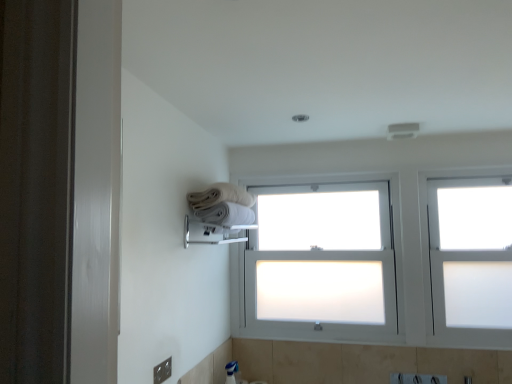
At what (x,y) coordinates should I click in order to perform the action: click on white cotton towels at upper center, which is counted as the 1th towel, starting from the top. Please return your answer as a coordinate pair (x, y). This screenshot has height=384, width=512. Looking at the image, I should click on coord(220,196).

I want to click on white soft towel at upper center, which is counted as the 2th towel, starting from the top, so click(226, 214).

This screenshot has height=384, width=512. What are the coordinates of `white frosted glass bay window at center` in the screenshot? It's located at tap(321, 256).

Does white frosted glass bay window at center come in front of white cotton towels at upper center, which is counted as the 1th towel, starting from the top?

No.

From a real-world perspective, is white frosted glass bay window at center physically located above or below white cotton towels at upper center, the 2th towel positioned from the bottom?

Clearly, from a real-world perspective, white frosted glass bay window at center is below white cotton towels at upper center, the 2th towel positioned from the bottom.

Is white frosted glass bay window at center positioned far away from white cotton towels at upper center, the 2th towel positioned from the bottom?

No.

Measure the distance between white frosted glass bay window at center and white cotton towels at upper center, which is counted as the 1th towel, starting from the top.

white frosted glass bay window at center is 25.94 inches away from white cotton towels at upper center, which is counted as the 1th towel, starting from the top.

What's the angular difference between polished chrome towel bar at upper center and metallic silver outlet at lower left's facing directions?

There is a 0.217-degree angle between the facing directions of polished chrome towel bar at upper center and metallic silver outlet at lower left.

From the image's perspective, is polished chrome towel bar at upper center located beneath metallic silver outlet at lower left?

Incorrect, from the image's perspective, polished chrome towel bar at upper center is higher than metallic silver outlet at lower left.

From a real-world perspective, is polished chrome towel bar at upper center positioned above or below metallic silver outlet at lower left?

polished chrome towel bar at upper center is above metallic silver outlet at lower left.

Considering the positions of objects polished chrome towel bar at upper center and metallic silver outlet at lower left in the image provided, who is more to the left, polished chrome towel bar at upper center or metallic silver outlet at lower left?

Positioned to the left is metallic silver outlet at lower left.

From their relative heights in the image, would you say white cotton towels at upper center, the 2th towel positioned from the bottom, is taller or shorter than white frosted glass window at upper right?

white cotton towels at upper center, the 2th towel positioned from the bottom, is shorter than white frosted glass window at upper right.

Is white cotton towels at upper center, which is counted as the 1th towel, starting from the top, behind white frosted glass window at upper right?

No, white cotton towels at upper center, which is counted as the 1th towel, starting from the top, is closer to the camera.

Is white cotton towels at upper center, which is counted as the 1th towel, starting from the top, facing away from white frosted glass window at upper right?

No, white cotton towels at upper center, which is counted as the 1th towel, starting from the top, is not facing away from white frosted glass window at upper right.

From the image's perspective, is white cotton towels at upper center, which is counted as the 1th towel, starting from the top, under white frosted glass window at upper right?

Incorrect, from the image's perspective, white cotton towels at upper center, which is counted as the 1th towel, starting from the top, is higher than white frosted glass window at upper right.

Does white frosted glass bay window at center come in front of white soft towel at upper center, which is counted as the 2th towel, starting from the top?

That is False.

In the scene shown: From the image's perspective, does white frosted glass bay window at center appear higher than white soft towel at upper center, which is counted as the 2th towel, starting from the top?

Actually, white frosted glass bay window at center appears below white soft towel at upper center, which is counted as the 2th towel, starting from the top, in the image.

In terms of height, does white frosted glass bay window at center look taller or shorter compared to white soft towel at upper center, positioned as the first towel in bottom-to-top order?

In the image, white frosted glass bay window at center appears to be taller than white soft towel at upper center, positioned as the first towel in bottom-to-top order.

Are white frosted glass bay window at center and white soft towel at upper center, which is counted as the 2th towel, starting from the top, located far from each other?

That's not correct — white frosted glass bay window at center is a little close to white soft towel at upper center, which is counted as the 2th towel, starting from the top.

At what (x,y) coordinates should I click in order to perform the action: click on window below the white soft towel at upper center, which is counted as the 2th towel, starting from the top (from the image's perspective). Please return your answer as a coordinate pair (x, y). This screenshot has width=512, height=384. Looking at the image, I should click on (470, 261).

From a real-world perspective, is white frosted glass window at upper right positioned under white soft towel at upper center, which is counted as the 2th towel, starting from the top, based on gravity?

Yes.

Is white frosted glass window at upper right at the left side of white soft towel at upper center, which is counted as the 2th towel, starting from the top?

No.

Can you confirm if white frosted glass window at upper right is wider than white soft towel at upper center, which is counted as the 2th towel, starting from the top?

In fact, white frosted glass window at upper right might be narrower than white soft towel at upper center, which is counted as the 2th towel, starting from the top.

Is white soft towel at upper center, which is counted as the 2th towel, starting from the top, closer to the viewer compared to white frosted glass window at upper right?

Yes, it is in front of white frosted glass window at upper right.

From the image's perspective, is white soft towel at upper center, positioned as the first towel in bottom-to-top order, beneath white frosted glass window at upper right?

No, from the image's perspective, white soft towel at upper center, positioned as the first towel in bottom-to-top order, is not beneath white frosted glass window at upper right.

Is white soft towel at upper center, which is counted as the 2th towel, starting from the top, oriented towards white frosted glass window at upper right?

Yes, white soft towel at upper center, which is counted as the 2th towel, starting from the top, faces towards white frosted glass window at upper right.

Can you confirm if white soft towel at upper center, which is counted as the 2th towel, starting from the top, is bigger than white frosted glass window at upper right?

No, white soft towel at upper center, which is counted as the 2th towel, starting from the top, is not bigger than white frosted glass window at upper right.

Which of these two, white soft towel at upper center, positioned as the first towel in bottom-to-top order, or white frosted glass bay window at center, is smaller?

Smaller between the two is white soft towel at upper center, positioned as the first towel in bottom-to-top order.

From the image's perspective, is white soft towel at upper center, positioned as the first towel in bottom-to-top order, under white frosted glass bay window at center?

No, from the image's perspective, white soft towel at upper center, positioned as the first towel in bottom-to-top order, is not below white frosted glass bay window at center.

Considering the relative sizes of white soft towel at upper center, which is counted as the 2th towel, starting from the top, and white frosted glass bay window at center in the image provided, is white soft towel at upper center, which is counted as the 2th towel, starting from the top, taller than white frosted glass bay window at center?

Incorrect, the height of white soft towel at upper center, which is counted as the 2th towel, starting from the top, is not larger of that of white frosted glass bay window at center.

From a real-world perspective, is white soft towel at upper center, positioned as the first towel in bottom-to-top order, positioned above or below white frosted glass bay window at center?

From a real-world perspective, white soft towel at upper center, positioned as the first towel in bottom-to-top order, is physically above white frosted glass bay window at center.

Find the location of a particular element. towel that is the 2nd object located in front of the white frosted glass bay window at center is located at coordinates (220, 196).

You are a GUI agent. You are given a task and a screenshot of the screen. Output one action in this format:
    pyautogui.click(x=<x>, y=<y>)
    Task: Click on the electric outlet on the left of polished chrome towel bar at upper center
    The image size is (512, 384).
    Given the screenshot: What is the action you would take?
    pyautogui.click(x=162, y=371)

Looking at the image, which one is located closer to white frosted glass window at upper right, white frosted glass bay window at center or polished chrome towel bar at upper center?

white frosted glass bay window at center is closer to white frosted glass window at upper right.

Based on their spatial positions, is white cotton towels at upper center, which is counted as the 1th towel, starting from the top, or metallic silver outlet at lower left closer to white frosted glass bay window at center?

Among the two, white cotton towels at upper center, which is counted as the 1th towel, starting from the top, is located nearer to white frosted glass bay window at center.

From the image, which object appears to be nearer to white cotton towels at upper center, the 2th towel positioned from the bottom, metallic silver outlet at lower left or white frosted glass window at upper right?

Based on the image, metallic silver outlet at lower left appears to be nearer to white cotton towels at upper center, the 2th towel positioned from the bottom.

Estimate the real-world distances between objects in this image. Which object is further from metallic silver outlet at lower left, white cotton towels at upper center, which is counted as the 1th towel, starting from the top, or white frosted glass window at upper right?

white frosted glass window at upper right.

Which object lies nearer to the anchor point white cotton towels at upper center, the 2th towel positioned from the bottom, metallic silver outlet at lower left or white frosted glass bay window at center?

white frosted glass bay window at center is closer to white cotton towels at upper center, the 2th towel positioned from the bottom.

Looking at the image, which one is located closer to white frosted glass bay window at center, white frosted glass window at upper right or white cotton towels at upper center, which is counted as the 1th towel, starting from the top?

Based on the image, white frosted glass window at upper right appears to be nearer to white frosted glass bay window at center.

When comparing their distances from white soft towel at upper center, positioned as the first towel in bottom-to-top order, does polished chrome towel bar at upper center or metallic silver outlet at lower left seem closer?

The object closer to white soft towel at upper center, positioned as the first towel in bottom-to-top order, is polished chrome towel bar at upper center.

Considering their positions, is white frosted glass window at upper right positioned further to polished chrome towel bar at upper center than white cotton towels at upper center, the 2th towel positioned from the bottom?

white frosted glass window at upper right is positioned further to the anchor polished chrome towel bar at upper center.

Image resolution: width=512 pixels, height=384 pixels. Find the location of `towel bar between white soft towel at upper center, which is counted as the 2th towel, starting from the top, and white frosted glass bay window at center, in the horizontal direction`. towel bar between white soft towel at upper center, which is counted as the 2th towel, starting from the top, and white frosted glass bay window at center, in the horizontal direction is located at coordinates (214, 232).

Where is `towel bar between white cotton towels at upper center, which is counted as the 1th towel, starting from the top, and metallic silver outlet at lower left, in the vertical direction`? The height and width of the screenshot is (384, 512). towel bar between white cotton towels at upper center, which is counted as the 1th towel, starting from the top, and metallic silver outlet at lower left, in the vertical direction is located at coordinates (214, 232).

Identify the location of towel bar located between white cotton towels at upper center, which is counted as the 1th towel, starting from the top, and white frosted glass bay window at center in the left-right direction. The width and height of the screenshot is (512, 384). (214, 232).

This screenshot has height=384, width=512. In order to click on towel bar between metallic silver outlet at lower left and white frosted glass bay window at center from left to right in this screenshot , I will do `click(214, 232)`.